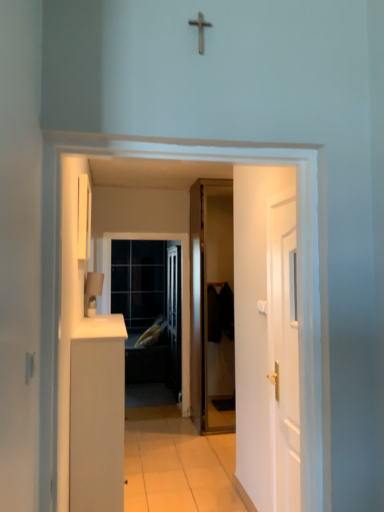
Where is `vacant space situated above white tile floor at center (from a real-world perspective)`? vacant space situated above white tile floor at center (from a real-world perspective) is located at coordinates click(182, 463).